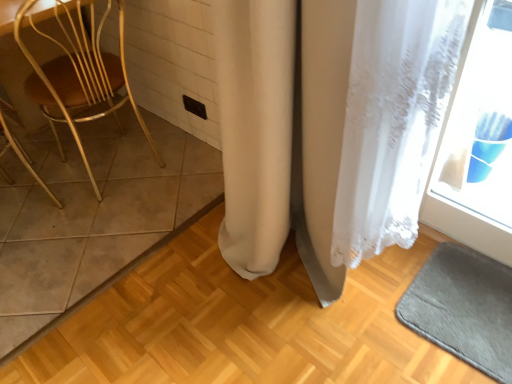
Locate an element on the screen. The image size is (512, 384). brown tile at left is located at coordinates (94, 218).

Which of these two, wooden chair at left or gray soft bath mat at lower right, stands taller?

Standing taller between the two is wooden chair at left.

Where is `chair that is on the left side of gray soft bath mat at lower right`? chair that is on the left side of gray soft bath mat at lower right is located at coordinates (79, 74).

Who is smaller, wooden chair at left or gray soft bath mat at lower right?

With smaller size is gray soft bath mat at lower right.

Considering the positions of objects wooden chair at left and gray soft bath mat at lower right in the image provided, who is more to the left, wooden chair at left or gray soft bath mat at lower right?

wooden chair at left is more to the left.

Does brown tile at left turn towards wooden chair at left?

Yes, brown tile at left is turned towards wooden chair at left.

Can you confirm if brown tile at left is taller than wooden chair at left?

In fact, brown tile at left may be shorter than wooden chair at left.

Considering the sizes of wooden chair at left and brown tile at left in the image, is wooden chair at left wider or thinner than brown tile at left?

Clearly, wooden chair at left has less width compared to brown tile at left.

Could you tell me if wooden chair at left is turned towards brown tile at left?

Yes, wooden chair at left is oriented towards brown tile at left.

Considering the relative positions of wooden chair at left and brown tile at left in the image provided, is wooden chair at left to the right of brown tile at left from the viewer's perspective?

Indeed, wooden chair at left is positioned on the right side of brown tile at left.

Based on the photo, from a real-world perspective, between wooden chair at left and brown tile at left, who is vertically higher?

wooden chair at left.

Based on the photo, is brown tile at left located within gray soft bath mat at lower right?

No.

Based on the photo, could you tell me if gray soft bath mat at lower right is turned towards brown tile at left?

No.

In terms of height, does gray soft bath mat at lower right look taller or shorter compared to brown tile at left?

gray soft bath mat at lower right is shorter than brown tile at left.

From the image's perspective, which is below, wooden chair at left or white lace curtain at center?

white lace curtain at center, from the image's perspective.

Which object is wider, wooden chair at left or white lace curtain at center?

wooden chair at left.

Would you say white lace curtain at center is part of wooden chair at left's contents?

That's incorrect, white lace curtain at center is not inside wooden chair at left.

Is wooden chair at left facing away from white lace curtain at center?

Yes.

Where is `chair on the left of the gray soft bath mat at lower right`? chair on the left of the gray soft bath mat at lower right is located at coordinates (79, 74).

Is gray soft bath mat at lower right facing towards wooden chair at left?

No, gray soft bath mat at lower right is not turned towards wooden chair at left.

Considering their positions, is gray soft bath mat at lower right located in front of or behind wooden chair at left?

Clearly, gray soft bath mat at lower right is in front of wooden chair at left.

From the image's perspective, is gray soft bath mat at lower right on top of wooden chair at left?

No, from the image's perspective, gray soft bath mat at lower right is not on top of wooden chair at left.

Is point (423, 40) less distant than point (482, 313)?

Yes, it is.

How distant is white lace curtain at center from gray soft bath mat at lower right?

They are 52.28 centimeters apart.

From a real-world perspective, between white lace curtain at center and gray soft bath mat at lower right, who is vertically lower?

From a 3D spatial view, gray soft bath mat at lower right is below.

From the picture: Is white lace curtain at center oriented towards gray soft bath mat at lower right?

No, white lace curtain at center is not facing towards gray soft bath mat at lower right.

The width and height of the screenshot is (512, 384). I want to click on chair lying above the gray soft bath mat at lower right (from the image's perspective), so click(x=79, y=74).

What are the coordinates of `tile that is behind the wooden chair at left` in the screenshot? It's located at (94, 218).

Considering their positions, is white lace curtain at center positioned closer to brown tile at left than wooden chair at left?

wooden chair at left is closer to brown tile at left.

Estimate the real-world distances between objects in this image. Which object is further from gray soft bath mat at lower right, wooden chair at left or white lace curtain at center?

wooden chair at left is further to gray soft bath mat at lower right.

When comparing their distances from white lace curtain at center, does gray soft bath mat at lower right or brown tile at left seem closer?

Based on the image, gray soft bath mat at lower right appears to be nearer to white lace curtain at center.

Estimate the real-world distances between objects in this image. Which object is further from wooden chair at left, gray soft bath mat at lower right or white lace curtain at center?

Based on the image, gray soft bath mat at lower right appears to be further to wooden chair at left.

Based on their spatial positions, is white lace curtain at center or brown tile at left further from wooden chair at left?

white lace curtain at center is further to wooden chair at left.

When comparing their distances from gray soft bath mat at lower right, does brown tile at left or white lace curtain at center seem closer?

Among the two, white lace curtain at center is located nearer to gray soft bath mat at lower right.

Which object lies further to the anchor point gray soft bath mat at lower right, white lace curtain at center or brown tile at left?

brown tile at left.

From the image, which object appears to be farther from brown tile at left, wooden chair at left or white lace curtain at center?

Among the two, white lace curtain at center is located further to brown tile at left.

Where is `curtain situated between wooden chair at left and gray soft bath mat at lower right from left to right`? curtain situated between wooden chair at left and gray soft bath mat at lower right from left to right is located at coordinates [x=369, y=125].

Where is `curtain located between brown tile at left and gray soft bath mat at lower right in the left-right direction`? curtain located between brown tile at left and gray soft bath mat at lower right in the left-right direction is located at coordinates (369, 125).

Locate an element on the screen. chair between brown tile at left and white lace curtain at center from left to right is located at coordinates (79, 74).

Locate an element on the screen. chair between brown tile at left and gray soft bath mat at lower right in the horizontal direction is located at coordinates (79, 74).